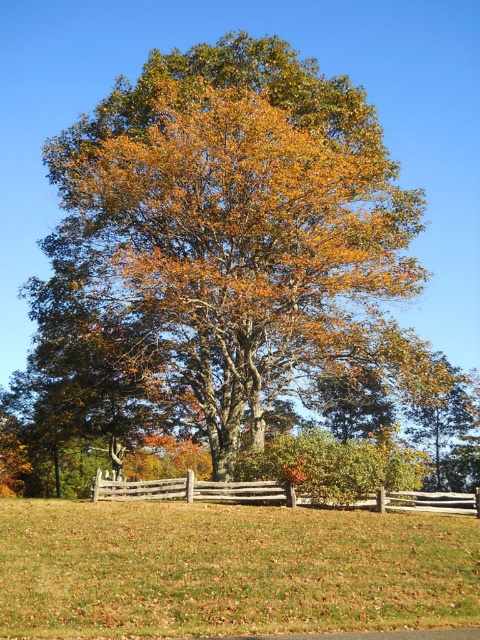
Question: Which object appears closest to the camera in this image?

Choices:
 (A) brown wooden fence at lower center
 (B) green grass at lower center
 (C) golden-brown bark oak at center

Answer: (B)

Question: Which of these objects is positioned farthest from the brown wooden fence at lower center?

Choices:
 (A) green grass at lower center
 (B) golden-brown bark oak at center

Answer: (B)

Question: Is green grass at lower center wider than brown wooden fence at lower center?

Choices:
 (A) yes
 (B) no

Answer: (B)

Question: Is golden-brown bark oak at center bigger than brown wooden fence at lower center?

Choices:
 (A) yes
 (B) no

Answer: (A)

Question: Does golden-brown bark oak at center appear on the left side of green grass at lower center?

Choices:
 (A) no
 (B) yes

Answer: (A)

Question: Estimate the real-world distances between objects in this image. Which object is farther from the brown wooden fence at lower center?

Choices:
 (A) golden-brown bark oak at center
 (B) green grass at lower center

Answer: (A)